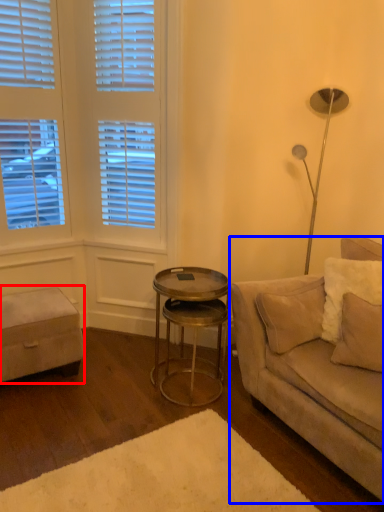
Question: Among these objects, which one is farthest to the camera, music stool (highlighted by a red box) or studio couch (highlighted by a blue box)?

Choices:
 (A) music stool
 (B) studio couch

Answer: (A)